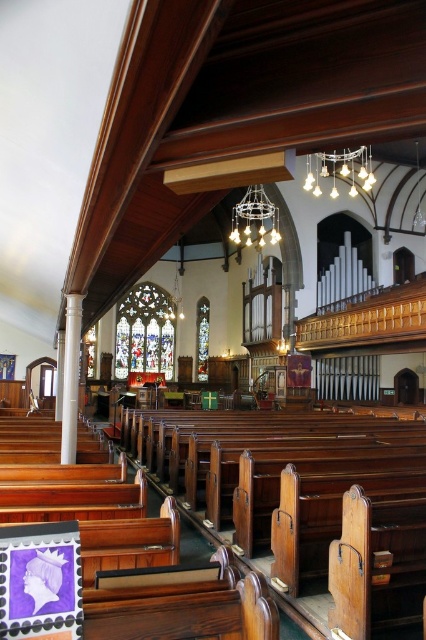
As you stand in the nave of the church, you notice a point marked at coordinates (339, 170). Which object does this point correspond to?

The point at coordinates (339, 170) corresponds to the matte glass chandelier at upper center.